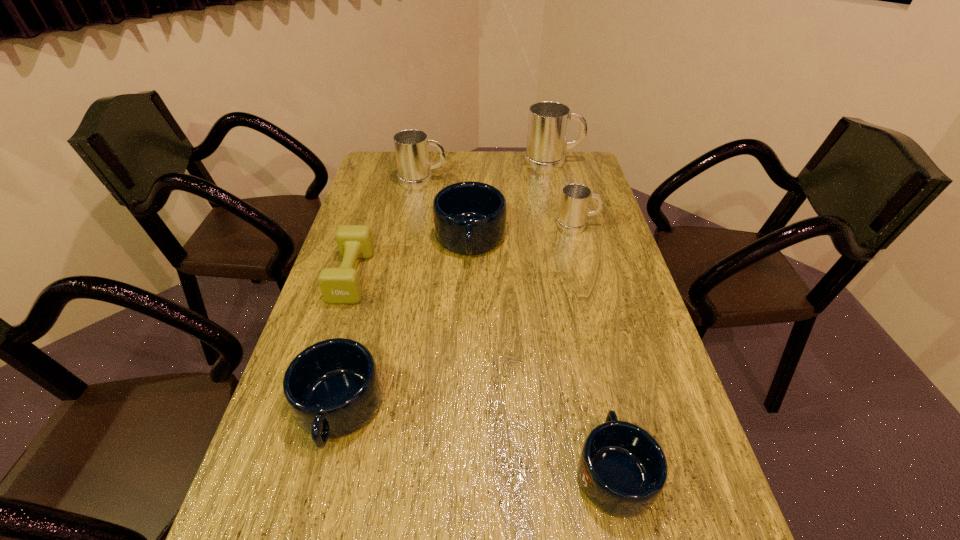
Identify the location of object that is at the far left corner. 411,146.

Locate an element on the screen. This screenshot has height=540, width=960. object that is at the far right corner is located at coordinates (548, 121).

Identify the location of free space at the far edge of the desktop. (444, 182).

Locate an element on the screen. Image resolution: width=960 pixels, height=540 pixels. vacant space at the left edge is located at coordinates (383, 247).

This screenshot has height=540, width=960. I want to click on free space at the right edge of the desktop, so click(604, 273).

In the image, there is a desktop. Identify the location of free space at the far right corner. (562, 177).

Find the location of a particular element. This screenshot has width=960, height=540. free point between the rightmost blue mug and the sixth shortest object is located at coordinates (518, 326).

Where is `free space between the dumbbell and the rightmost blue mug`? This screenshot has width=960, height=540. free space between the dumbbell and the rightmost blue mug is located at coordinates (483, 373).

The height and width of the screenshot is (540, 960). Find the location of `vacant area between the farthest blue mug and the smallest gray mug`. vacant area between the farthest blue mug and the smallest gray mug is located at coordinates (524, 233).

Where is `free space between the smallest gray mug and the smallest blue mug`? The image size is (960, 540). free space between the smallest gray mug and the smallest blue mug is located at coordinates (596, 348).